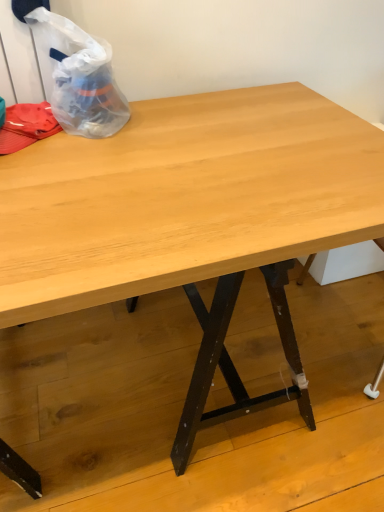
Locate an element on the screen. Image resolution: width=384 pixels, height=512 pixels. transparent plastic bag at upper left is located at coordinates tap(80, 77).

What is the approximate width of transparent plastic bag at upper left?

transparent plastic bag at upper left is 11.17 inches wide.

This screenshot has width=384, height=512. What do you see at coordinates (80, 77) in the screenshot?
I see `transparent plastic bag at upper left` at bounding box center [80, 77].

The width and height of the screenshot is (384, 512). I want to click on transparent plastic bag at upper left, so click(80, 77).